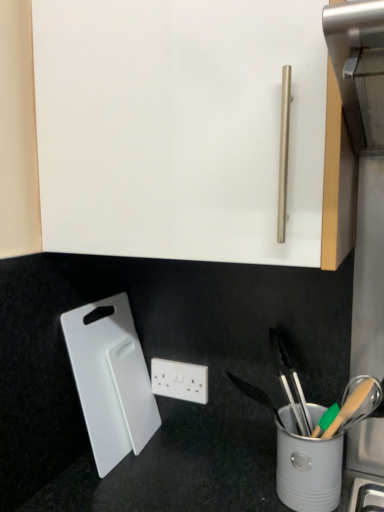
Describe the element at coordinates (179, 380) in the screenshot. I see `white plastic power plugs and sockets at center` at that location.

Find the location of a particular element. The height and width of the screenshot is (512, 384). white plastic power plugs and sockets at center is located at coordinates (179, 380).

I want to click on white plastic cutting board at lower left, so click(111, 379).

The width and height of the screenshot is (384, 512). Describe the element at coordinates (111, 379) in the screenshot. I see `white plastic cutting board at lower left` at that location.

At what (x,y) coordinates should I click in order to perform the action: click on white plastic power plugs and sockets at center. Please return your answer as a coordinate pair (x, y). Looking at the image, I should click on (179, 380).

Is white plastic cutting board at lower left at the left side of white plastic power plugs and sockets at center?

Yes.

Consider the image. Which is behind, white plastic cutting board at lower left or white plastic power plugs and sockets at center?

white plastic power plugs and sockets at center is behind.

Which point is more forward, (136,361) or (193,401)?

A: The point (193,401) is closer.

Looking at this image, from the image's perspective, which one is positioned higher, white plastic cutting board at lower left or white plastic power plugs and sockets at center?

white plastic cutting board at lower left.

From a real-world perspective, which is physically above, white plastic cutting board at lower left or white plastic power plugs and sockets at center?

white plastic cutting board at lower left, from a real-world perspective.

Does white plastic cutting board at lower left have a lesser width compared to white plastic power plugs and sockets at center?

In fact, white plastic cutting board at lower left might be wider than white plastic power plugs and sockets at center.

Can you confirm if white plastic cutting board at lower left is shorter than white plastic power plugs and sockets at center?

In fact, white plastic cutting board at lower left may be taller than white plastic power plugs and sockets at center.

Considering the sizes of objects white plastic cutting board at lower left and white plastic power plugs and sockets at center in the image provided, who is smaller, white plastic cutting board at lower left or white plastic power plugs and sockets at center?

white plastic power plugs and sockets at center.

Is white plastic cutting board at lower left not within white plastic power plugs and sockets at center?

Yes, white plastic cutting board at lower left is not within white plastic power plugs and sockets at center.

Is white plastic cutting board at lower left next to white plastic power plugs and sockets at center?

No, white plastic cutting board at lower left is not making contact with white plastic power plugs and sockets at center.

Is white plastic cutting board at lower left oriented away from white plastic power plugs and sockets at center?

Yes, white plastic power plugs and sockets at center is at the back of white plastic cutting board at lower left.

Measure the distance from white plastic cutting board at lower left to white plastic power plugs and sockets at center.

A distance of 5.64 inches exists between white plastic cutting board at lower left and white plastic power plugs and sockets at center.

At what (x,y) coordinates should I click in order to perform the action: click on power plugs and sockets behind the white plastic cutting board at lower left. Please return your answer as a coordinate pair (x, y). The width and height of the screenshot is (384, 512). Looking at the image, I should click on (179, 380).

Based on their positions, is white plastic power plugs and sockets at center located to the left or right of white plastic cutting board at lower left?

From the image, it's evident that white plastic power plugs and sockets at center is to the right of white plastic cutting board at lower left.

From the picture: Is the depth of white plastic power plugs and sockets at center greater than that of white plastic cutting board at lower left?

Yes, white plastic power plugs and sockets at center is behind white plastic cutting board at lower left.

Does point (187, 368) lie behind point (134, 331)?

No.

In the scene shown: From the image's perspective, is white plastic power plugs and sockets at center over white plastic cutting board at lower left?

No, from the image's perspective, white plastic power plugs and sockets at center is not above white plastic cutting board at lower left.

From a real-world perspective, is white plastic power plugs and sockets at center located beneath white plastic cutting board at lower left?

Correct, in the physical world, white plastic power plugs and sockets at center is lower than white plastic cutting board at lower left.

Is white plastic power plugs and sockets at center wider or thinner than white plastic cutting board at lower left?

In the image, white plastic power plugs and sockets at center appears to be more narrow than white plastic cutting board at lower left.

Considering the sizes of objects white plastic power plugs and sockets at center and white plastic cutting board at lower left in the image provided, who is taller, white plastic power plugs and sockets at center or white plastic cutting board at lower left?

white plastic cutting board at lower left.

Does white plastic power plugs and sockets at center have a smaller size compared to white plastic cutting board at lower left?

Yes, white plastic power plugs and sockets at center is smaller than white plastic cutting board at lower left.

Is white plastic cutting board at lower left a part of white plastic power plugs and sockets at center?

That's incorrect, white plastic cutting board at lower left is not inside white plastic power plugs and sockets at center.

Is white plastic power plugs and sockets at center far away from white plastic cutting board at lower left?

No, there isn't a large distance between white plastic power plugs and sockets at center and white plastic cutting board at lower left.

Is white plastic power plugs and sockets at center aimed at white plastic cutting board at lower left?

Yes, white plastic power plugs and sockets at center is oriented towards white plastic cutting board at lower left.

How many degrees apart are the facing directions of white plastic power plugs and sockets at center and white plastic cutting board at lower left?

They differ by 94.3 degrees in their facing directions.

Measure the distance between white plastic power plugs and sockets at center and white plastic cutting board at lower left.

They are 5.64 inches apart.

This screenshot has height=512, width=384. Identify the location of cutting board positioned vertically above the white plastic power plugs and sockets at center (from a real-world perspective). (111, 379).

You are a GUI agent. You are given a task and a screenshot of the screen. Output one action in this format:
    pyautogui.click(x=<x>, y=<y>)
    Task: Click on the power plugs and sockets below the white plastic cutting board at lower left (from a real-world perspective)
    The width and height of the screenshot is (384, 512).
    Given the screenshot: What is the action you would take?
    pyautogui.click(x=179, y=380)

Image resolution: width=384 pixels, height=512 pixels. What are the coordinates of `power plugs and sockets on the right of white plastic cutting board at lower left` in the screenshot? It's located at (179, 380).